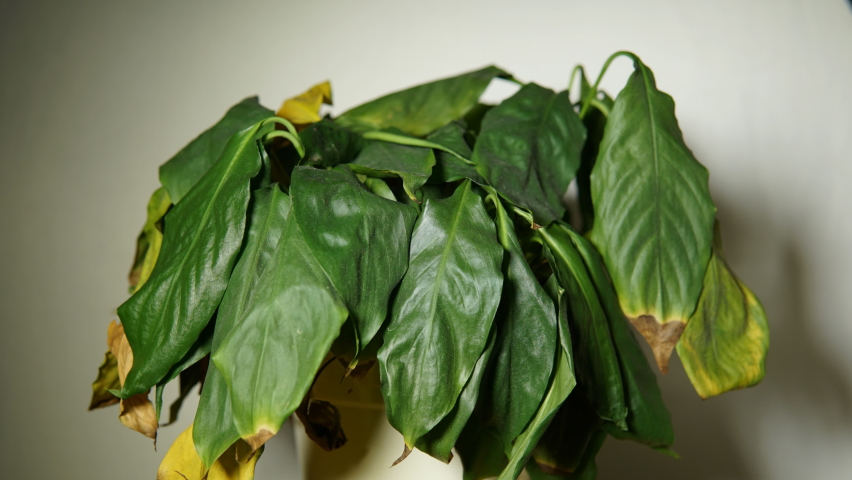
Locate an element on the screen. Image resolution: width=852 pixels, height=480 pixels. wall is located at coordinates (67, 71), (711, 56).